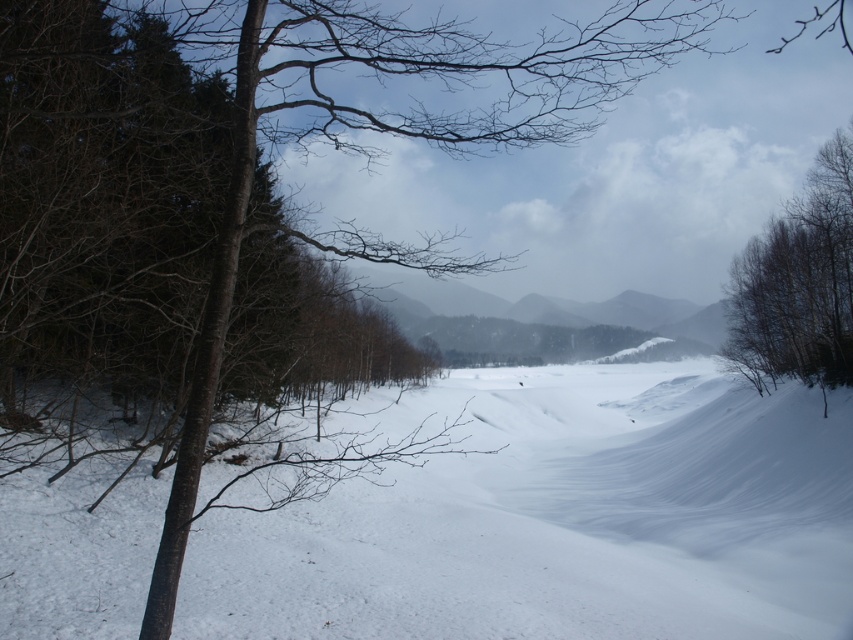
Question: Which of the following is the farthest from the observer?

Choices:
 (A) (276, 593)
 (B) (755, 381)
 (C) (508, 340)

Answer: (C)

Question: Which point is farther to the camera?

Choices:
 (A) brown textured tree at right
 (B) white snow at center
 (C) gray matte mountain at center

Answer: (C)

Question: From the image, what is the correct spatial relationship of white snow at center in relation to gray matte mountain at center?

Choices:
 (A) above
 (B) below

Answer: (B)

Question: Which object is the farthest from the gray matte mountain at center?

Choices:
 (A) white snow at center
 (B) brown textured tree at right

Answer: (B)

Question: Can you confirm if white snow at center is smaller than gray matte mountain at center?

Choices:
 (A) no
 (B) yes

Answer: (A)

Question: Is white snow at center bigger than brown textured tree at right?

Choices:
 (A) yes
 (B) no

Answer: (A)